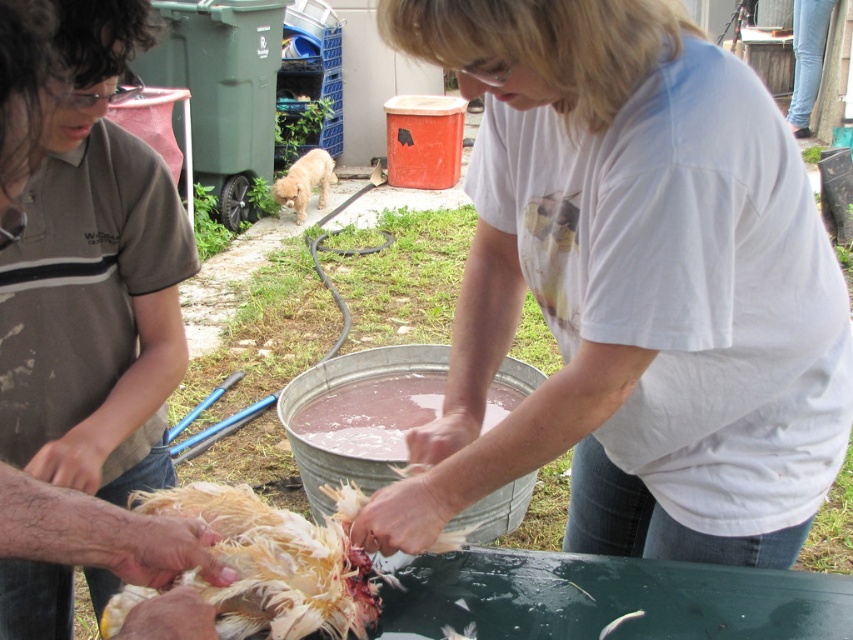
You are standing at the point marked as point (108, 285) in the image. You want to hand a tool to the person in the brown shirt who is observing the chicken processing. Can you reach them without moving from your current position if your arm can extend 1 meter?

The distance between you and the person in the brown shirt is 1.22 meters, which is greater than your arm extension of 1 meter. Therefore, you cannot reach them without moving.

You are standing in the outdoor scene where two people are processing a chicken. You need to place a small stool between the two points labeled as point (489, 378) and point (325, 168). Which point should the stool be closer to if you want it nearer to the person handling the chicken?

The stool should be placed closer to point (489, 378) because it is closer to the viewer, which is where the person handling the chicken is located.

You are planning to wear a shirt that is wider than the other. Which shirt should you choose between the white cotton shirt at center and the brown cotton shirt at upper left?

The white cotton shirt at center is wider than the brown cotton shirt at upper left, so you should choose the white cotton shirt at center.